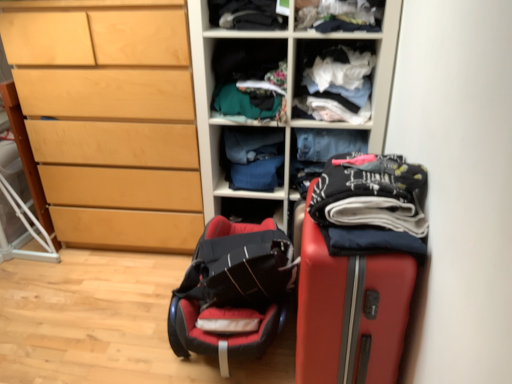
Where is `blank space to the left of soft leather suitcase at lower left`? blank space to the left of soft leather suitcase at lower left is located at coordinates (108, 314).